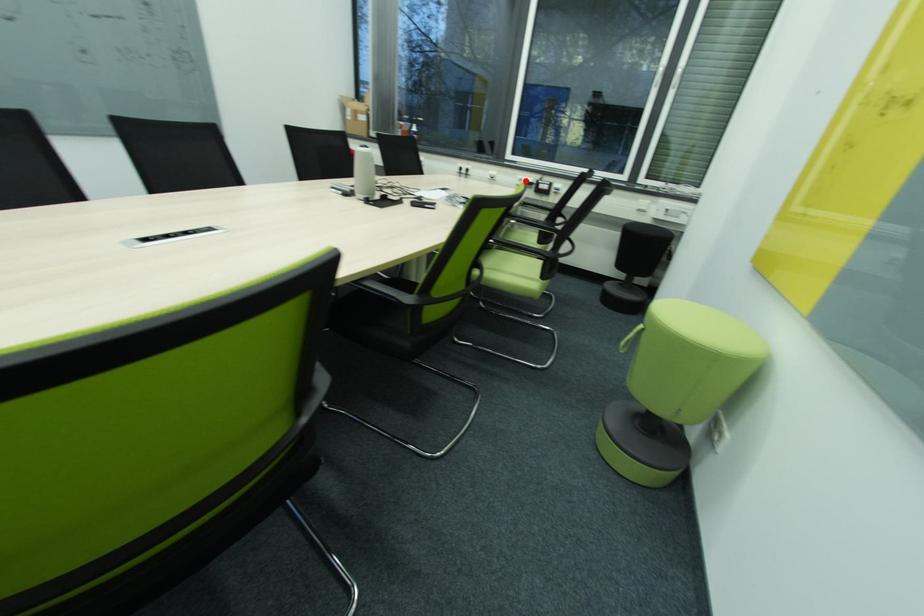
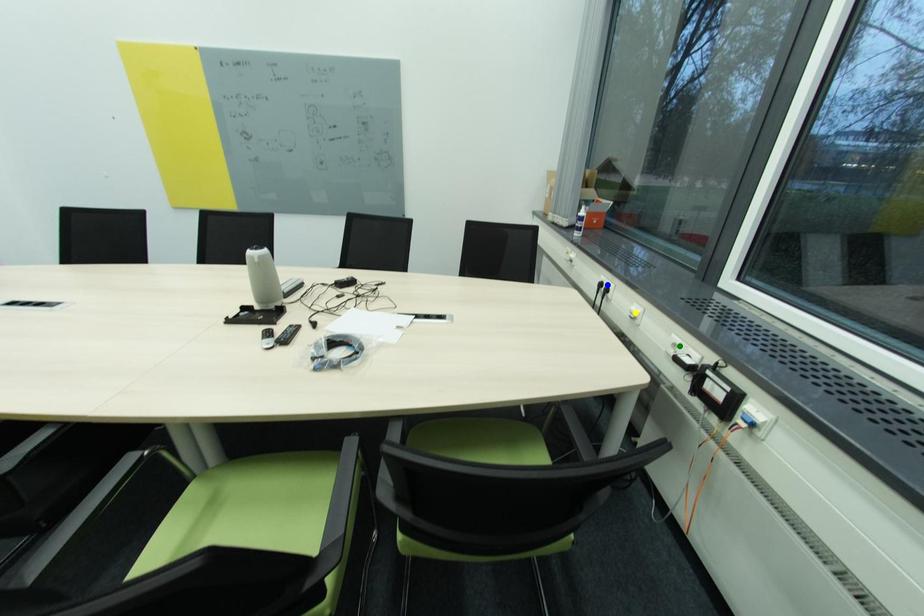
Question: I am providing you with two images of the same scene from different viewpoints. A red point is marked on the first image. You are given multiple points on the second image. Which mark in image 2 goes with the point in image 1?

Choices:
 (A) yellow point
 (B) green point
 (C) blue point

Answer: (B)